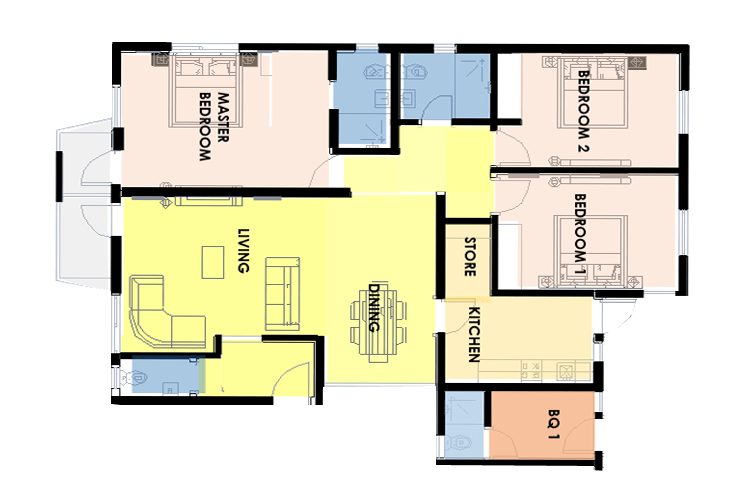
This screenshot has width=750, height=500. Find the location of `coffee table`. coffee table is located at coordinates (220, 263).